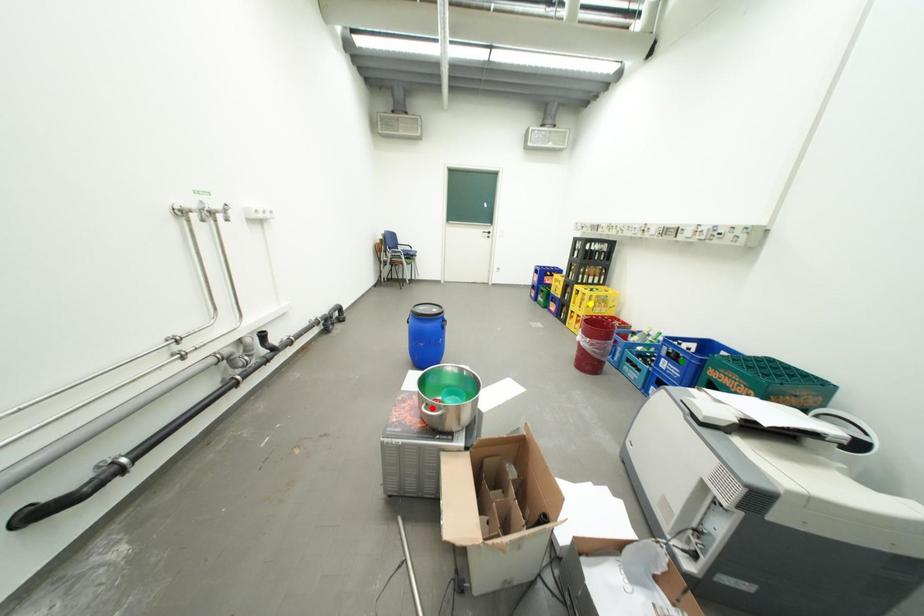
From the picture: Order these from nearest to farthest:
- green point
- red point
- yellow point

yellow point
green point
red point